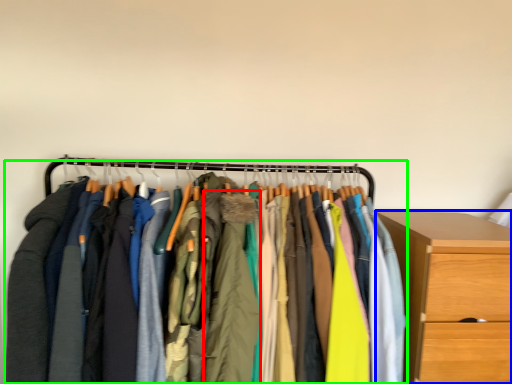
Question: Which is nearer to the clothing (highlighted by a red box)? chest of drawers (highlighted by a blue box) or closet (highlighted by a green box).

Choices:
 (A) chest of drawers
 (B) closet

Answer: (B)